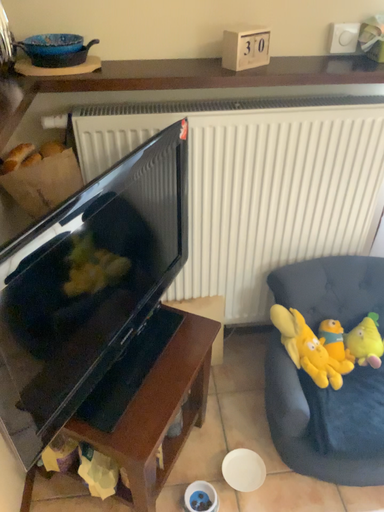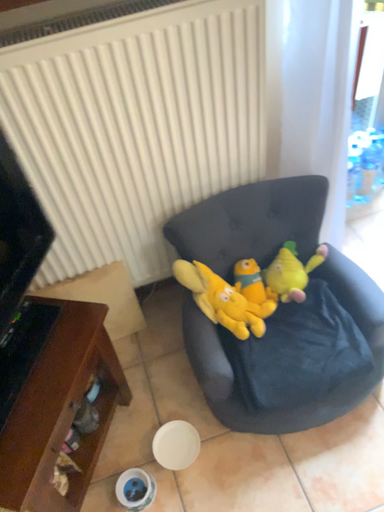
Question: How did the camera likely rotate when shooting the video?

Choices:
 (A) rotated upward
 (B) rotated downward

Answer: (B)